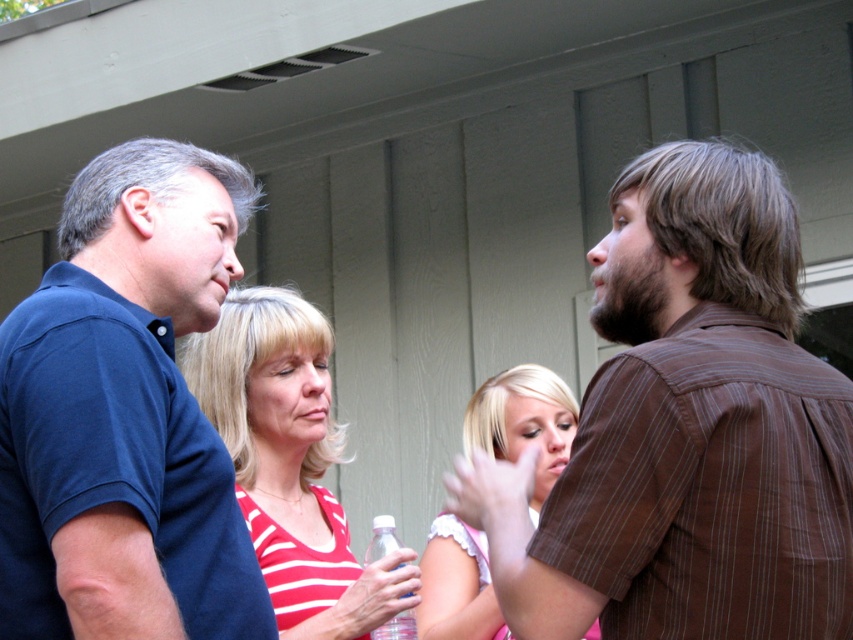
Question: Can you confirm if brown striped shirt at right is wider than dark blue polo shirt at left?

Choices:
 (A) no
 (B) yes

Answer: (B)

Question: Which of the following is the closest to the observer?

Choices:
 (A) (546, 413)
 (B) (238, 556)

Answer: (B)

Question: Which of the following is the closest to the observer?

Choices:
 (A) dark blue polo shirt at left
 (B) clear plastic bottle at center

Answer: (A)

Question: Estimate the real-world distances between objects in this image. Which object is closer to the striped fabric tank top at center?

Choices:
 (A) brown striped shirt at right
 (B) clear plastic bottle at center
 (C) blonde hair at center
 (D) dark blue polo shirt at left

Answer: (B)

Question: Can you confirm if striped fabric tank top at center is thinner than clear plastic bottle at center?

Choices:
 (A) no
 (B) yes

Answer: (A)

Question: Observing the image, what is the correct spatial positioning of dark blue polo shirt at left in reference to clear plastic bottle at center?

Choices:
 (A) right
 (B) left

Answer: (B)